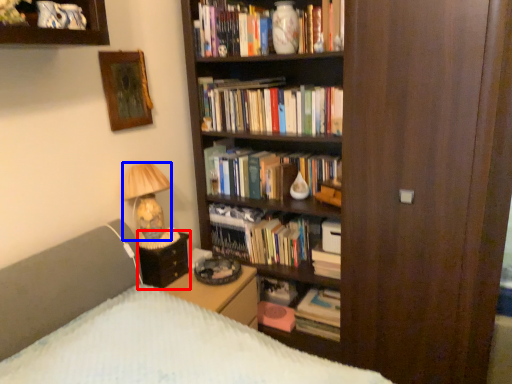
Question: Which of the following is the closest to the observer, side table (highlighted by a red box) or lamp (highlighted by a blue box)?

Choices:
 (A) side table
 (B) lamp

Answer: (B)